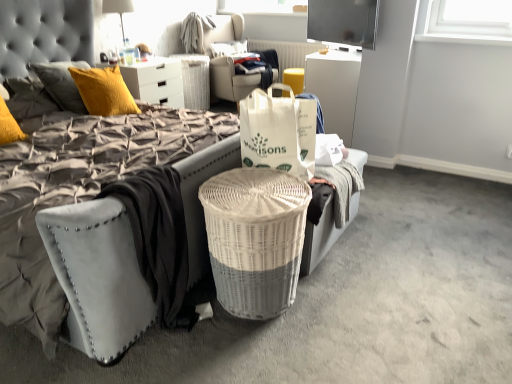
Question: From a real-world perspective, is flat screen tv at upper center on suede-like gray mattress at lower left?

Choices:
 (A) no
 (B) yes

Answer: (B)

Question: Can you see flat screen tv at upper center touching suede-like gray mattress at lower left?

Choices:
 (A) yes
 (B) no

Answer: (B)

Question: Is suede-like gray mattress at lower left at the back of flat screen tv at upper center?

Choices:
 (A) yes
 (B) no

Answer: (B)

Question: Is flat screen tv at upper center outside of suede-like gray mattress at lower left?

Choices:
 (A) no
 (B) yes

Answer: (B)

Question: Considering the relative sizes of flat screen tv at upper center and suede-like gray mattress at lower left in the image provided, is flat screen tv at upper center smaller than suede-like gray mattress at lower left?

Choices:
 (A) no
 (B) yes

Answer: (B)

Question: From the image's perspective, is white woven bag at center located above or below matte white dresser at upper center?

Choices:
 (A) above
 (B) below

Answer: (B)

Question: In terms of size, does white woven bag at center appear bigger or smaller than matte white dresser at upper center?

Choices:
 (A) small
 (B) big

Answer: (A)

Question: Is point (250, 142) positioned closer to the camera than point (156, 84)?

Choices:
 (A) farther
 (B) closer

Answer: (B)

Question: Is white woven bag at center spatially inside matte white dresser at upper center, or outside of it?

Choices:
 (A) inside
 (B) outside

Answer: (B)

Question: Considering the relative positions of flat screen tv at upper center and velvet grey bed at center in the image provided, is flat screen tv at upper center to the left or to the right of velvet grey bed at center?

Choices:
 (A) right
 (B) left

Answer: (A)

Question: Relative to velvet grey bed at center, is flat screen tv at upper center in front or behind?

Choices:
 (A) behind
 (B) front

Answer: (A)

Question: From the image's perspective, is flat screen tv at upper center positioned above or below velvet grey bed at center?

Choices:
 (A) above
 (B) below

Answer: (A)

Question: Considering the positions of point (359, 23) and point (138, 314), is point (359, 23) closer or farther from the camera than point (138, 314)?

Choices:
 (A) closer
 (B) farther

Answer: (B)

Question: Would you say white wicker trash bin/can at center is inside or outside white woven bag at center?

Choices:
 (A) inside
 (B) outside

Answer: (B)

Question: Is white wicker trash bin/can at center wider or thinner than white woven bag at center?

Choices:
 (A) wide
 (B) thin

Answer: (A)